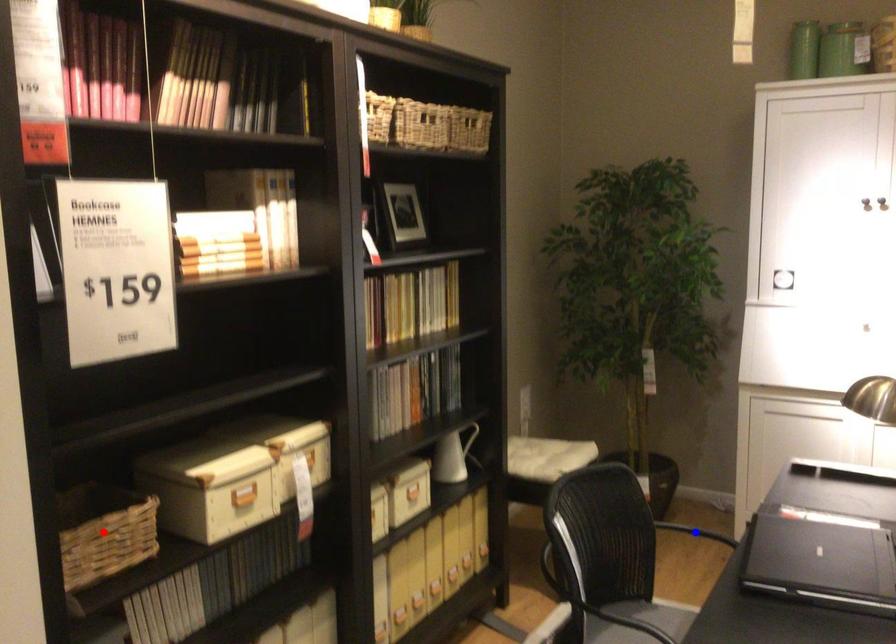
Question: In the image, two points are highlighted. Which point is nearer to the camera? Reply with the corresponding letter.

Choices:
 (A) blue point
 (B) red point

Answer: (B)